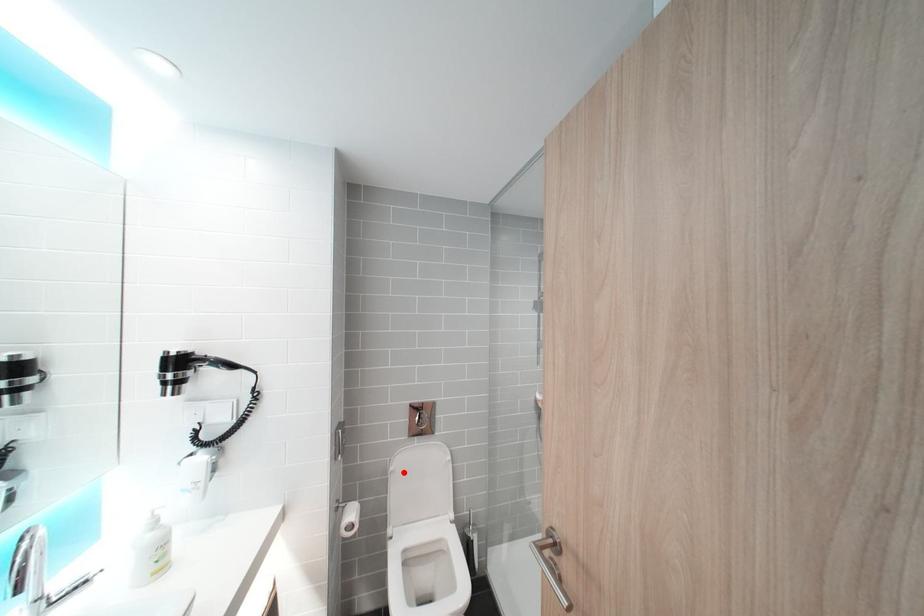
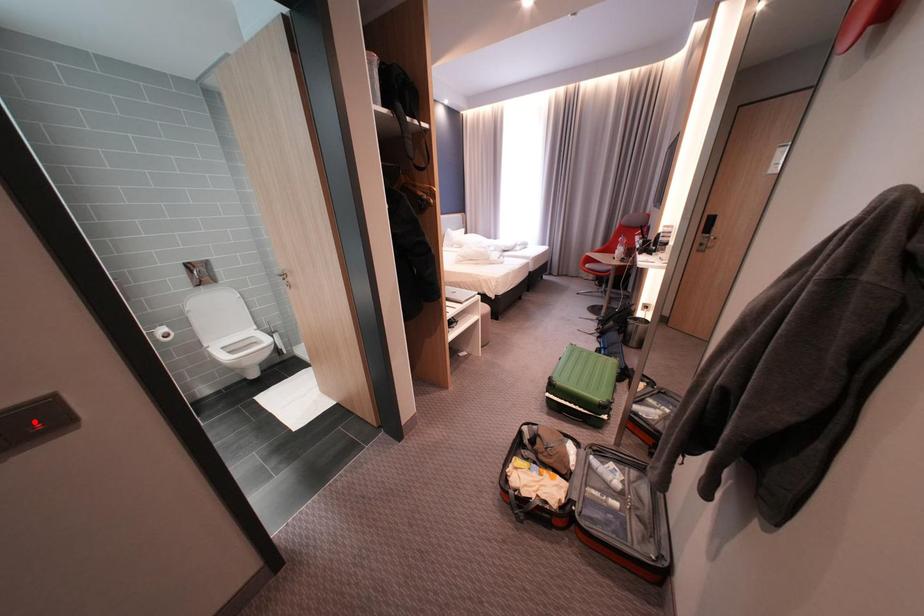
I am providing you with two images of the same scene from different viewpoints. A red point is marked on the first image and another point is marked on the second image. Does the point marked in image1 correspond to the same location as the one in image2?

No